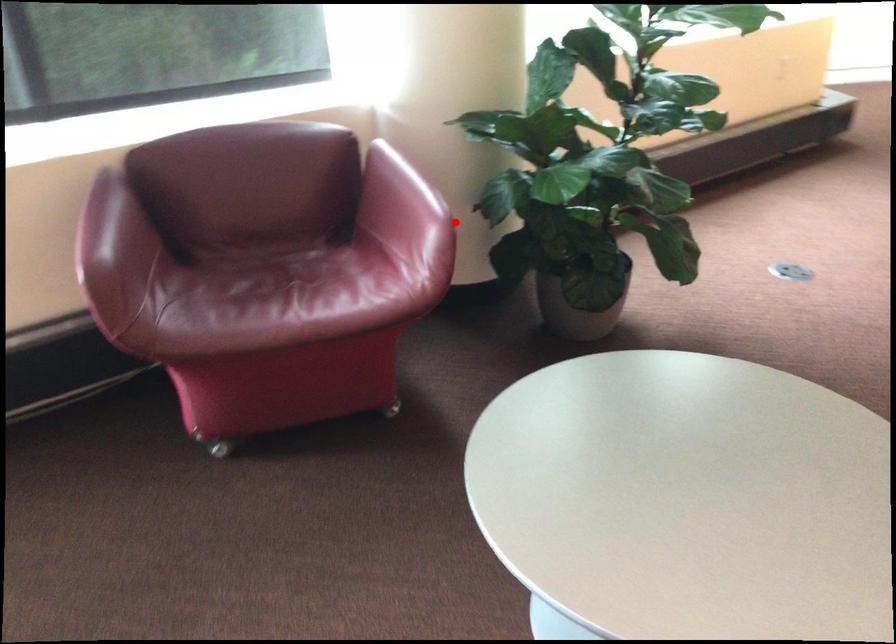
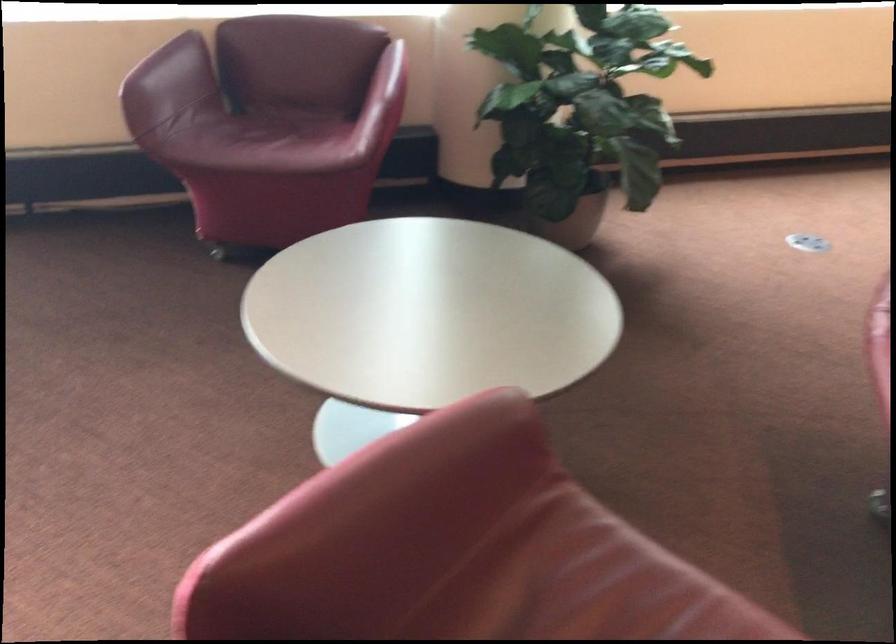
Find the pixel in the second image that matches the highlighted location in the first image.

(385, 100)